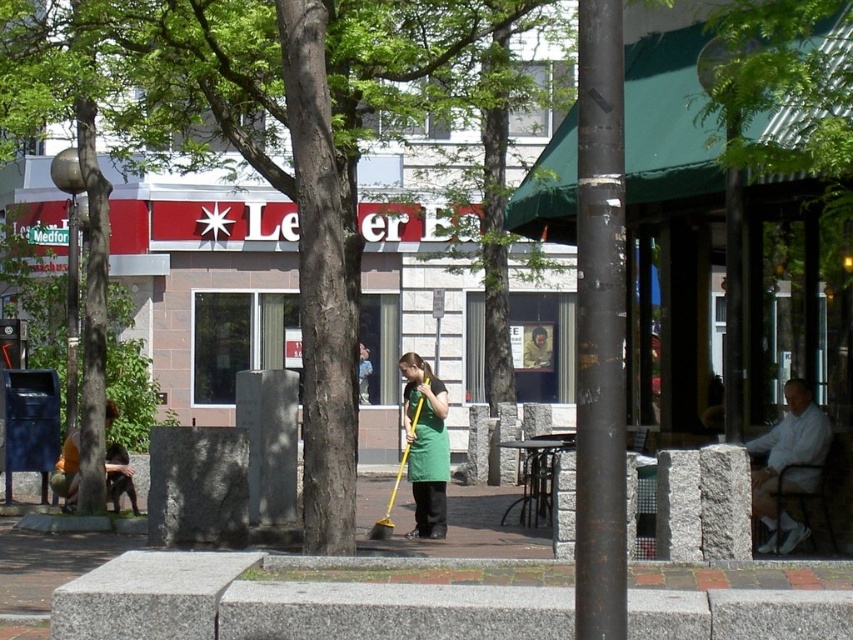
You are a painter setting up an easel in the plaza. You want to paint both the rusty metal pole at center and the white cotton shirt at right. Which object should you focus on first if you want to paint the wider object?

The white cotton shirt at right is wider than the rusty metal pole at center, so you should focus on painting the white cotton shirt at right first.

You are standing at the point with coordinates point (584, 262) and want to walk towards the point with coordinates point (817, 467). Will you have to go around any obstacles along the way?

Point (584, 262) is in front of point (817, 467), so you will have to go around any obstacles between them.

You are a pedestrian walking along the path in the plaza and see the green leafy tree at center and the white cotton shirt at right. Which object is located to the left of the other?

The green leafy tree at center is positioned on the left side of white cotton shirt at right.